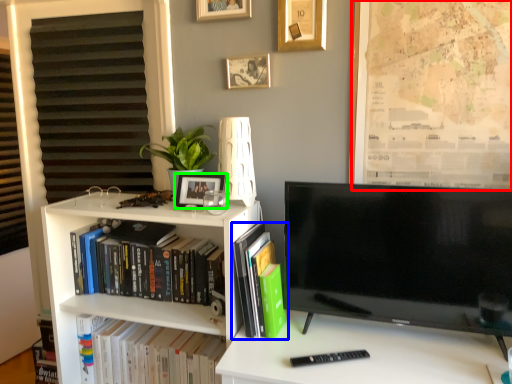
Question: Which object is positioned farthest from bulletin board (highlighted by a red box)? Select from book (highlighted by a blue box) and picture frame (highlighted by a green box).

Choices:
 (A) book
 (B) picture frame

Answer: (B)